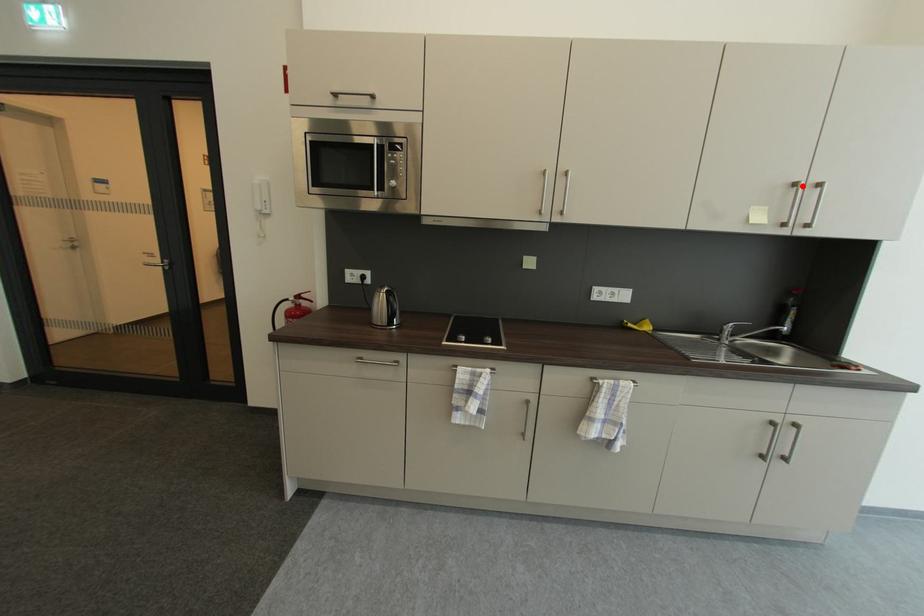
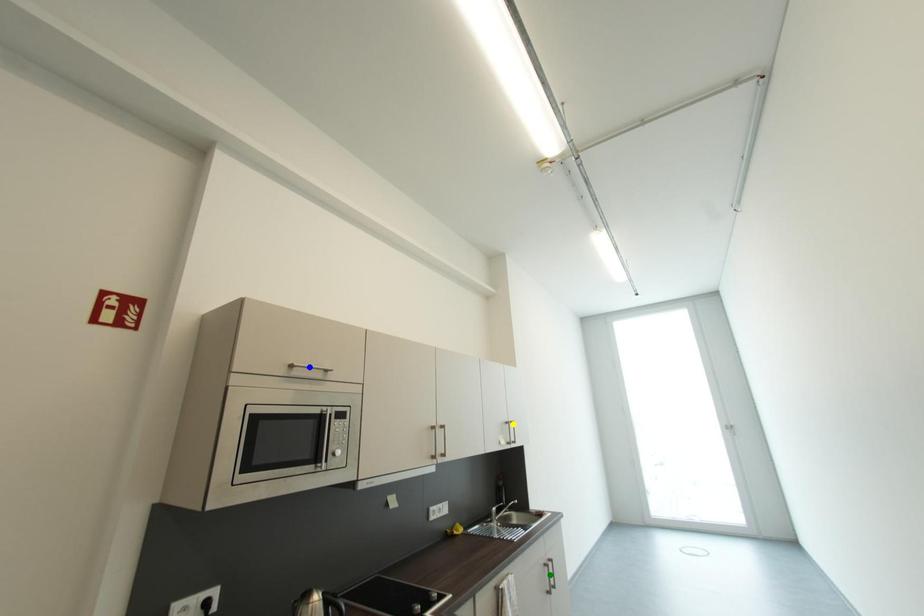
Question: I am providing you with two images of the same scene from different viewpoints. A red point is marked on the first image. You are given multiple points on the second image. Which point in image 2 is actually the same real-world point as the red point in image 1?

Choices:
 (A) green point
 (B) yellow point
 (C) blue point

Answer: (B)